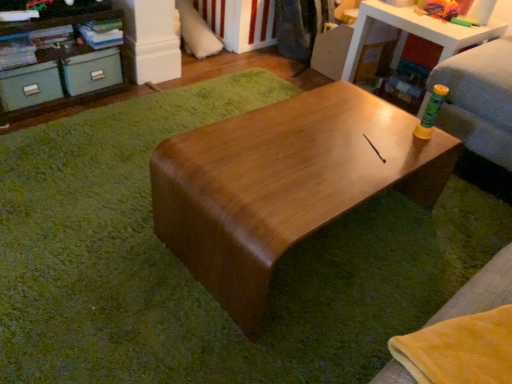
At what (x,y) coordinates should I click in order to perform the action: click on free space in front of matte green drawer at left, the 2th drawer in the left-to-right sequence. Please return your answer as a coordinate pair (x, y). Looking at the image, I should click on (88, 114).